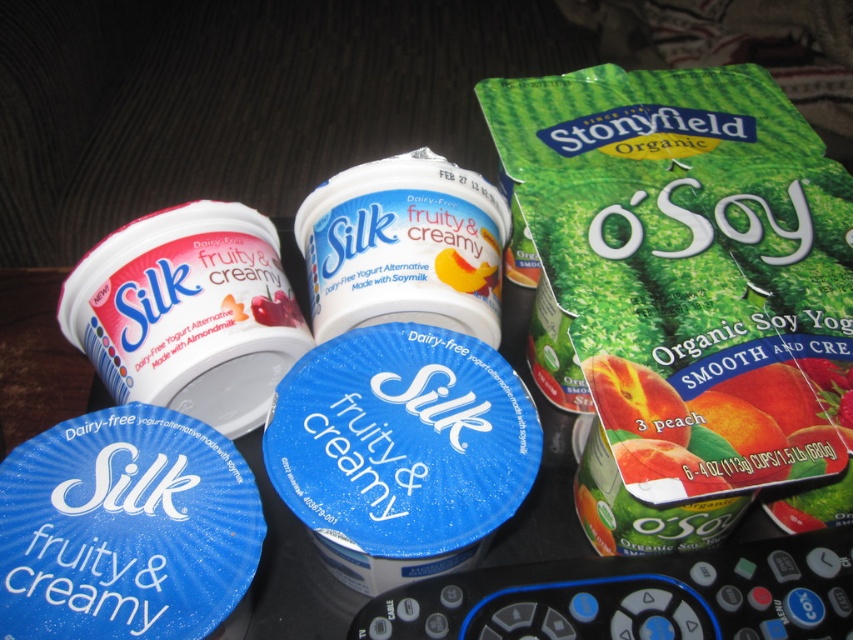
At what (x,y) coordinates should I click in order to perform the action: click on matte white yogurt at center. Please return your answer as a coordinate pair (x, y). The height and width of the screenshot is (640, 853). Looking at the image, I should click on (189, 314).

Can you confirm if matte white yogurt at center is positioned above white matte yogurt at center?

Incorrect, matte white yogurt at center is not positioned above white matte yogurt at center.

Which is behind, point (299, 340) or point (457, 300)?

The point (457, 300) is more distant.

Identify the location of matte white yogurt at center. This screenshot has height=640, width=853. (189, 314).

Who is more forward, (x=775, y=349) or (x=370, y=180)?

Point (x=775, y=349)

Between green matte pouch at upper right and white matte yogurt at center, which one is positioned higher?

white matte yogurt at center is above.

Is point (746, 298) more distant than point (311, 296)?

No.

Identify the location of green matte pouch at upper right. (688, 292).

Is green matte pouch at upper right smaller than matte white yogurt at center?

Incorrect, green matte pouch at upper right is not smaller in size than matte white yogurt at center.

What do you see at coordinates (688, 292) in the screenshot? I see `green matte pouch at upper right` at bounding box center [688, 292].

The image size is (853, 640). Identify the location of green matte pouch at upper right. (688, 292).